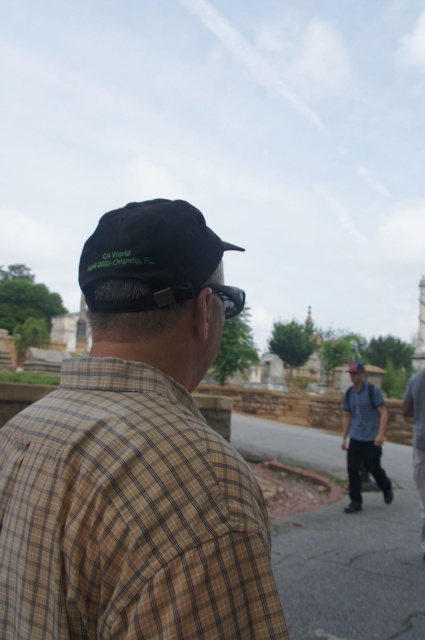
Question: Is black fabric baseball cap at upper left wider than blue denim shirt at center?

Choices:
 (A) no
 (B) yes

Answer: (B)

Question: Can you confirm if denim pants at right is positioned to the left of matte black cap at center?

Choices:
 (A) no
 (B) yes

Answer: (B)

Question: Based on their relative distances, which object is nearer to the gray asphalt pavement at lower center?

Choices:
 (A) black fabric baseball cap at upper left
 (B) brown checkered shirt at center

Answer: (B)

Question: Which object is positioned closest to the brown checkered shirt at center?

Choices:
 (A) transparent plastic goggles at center
 (B) blue denim shirt at center
 (C) gray cotton shirt at center

Answer: (A)

Question: Which point is farther to the camera?

Choices:
 (A) (350, 502)
 (B) (212, 593)
 (C) (414, 417)
 (D) (317, 531)

Answer: (C)

Question: Does gray cotton shirt at center have a smaller size compared to transparent plastic goggles at center?

Choices:
 (A) yes
 (B) no

Answer: (B)